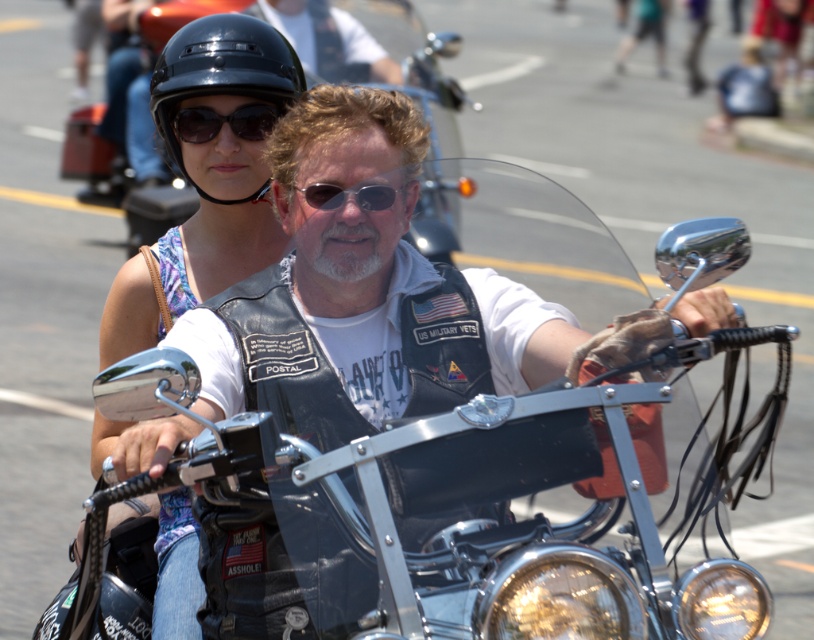
Which is behind, point (427, 227) or point (241, 138)?

The point (241, 138) is more distant.

Consider the image. Who is more forward, (224, 16) or (200, 132)?

Point (224, 16) is in front.

The image size is (814, 640). In order to click on glossy black helmet at upper left in this screenshot , I will do `click(435, 84)`.

Which is in front, point (248, 128) or point (368, 193)?

Positioned in front is point (368, 193).

Who is positioned more to the left, matte black sunglasses at upper center or black plastic sunglasses at center?

From the viewer's perspective, matte black sunglasses at upper center appears more on the left side.

The image size is (814, 640). I want to click on matte black sunglasses at upper center, so click(x=222, y=122).

Is black matte helmet at upper left to the right of matte black sunglasses at upper center from the viewer's perspective?

In fact, black matte helmet at upper left is to the left of matte black sunglasses at upper center.

Can you confirm if black matte helmet at upper left is thinner than matte black sunglasses at upper center?

No.

Is point (186, 24) less distant than point (252, 138)?

No, (186, 24) is further to viewer.

The image size is (814, 640). I want to click on black matte helmet at upper left, so click(221, 74).